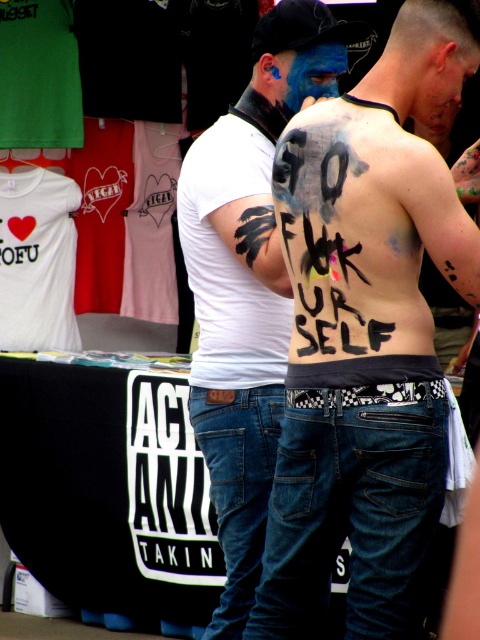
In the scene shown: Can you confirm if white matte shirt at center is wider than black paint text at back?

Yes, white matte shirt at center is wider than black paint text at back.

Is white matte shirt at center closer to the viewer compared to black paint text at back?

No, white matte shirt at center is further to the viewer.

Measure the distance between white matte shirt at center and camera.

white matte shirt at center is 4.66 meters from camera.

The height and width of the screenshot is (640, 480). Identify the location of white matte shirt at center. (247, 285).

What do you see at coordinates (367, 333) in the screenshot? I see `black matte skin at center` at bounding box center [367, 333].

Between point (399, 97) and point (262, 492), which one is positioned behind?

The point (262, 492) is more distant.

Locate an element on the screen. The height and width of the screenshot is (640, 480). black matte skin at center is located at coordinates (367, 333).

Does black paint text at back have a lesser height compared to white matte t-shirt at left?

Yes, black paint text at back is shorter than white matte t-shirt at left.

Does black paint text at back appear under white matte t-shirt at left?

Indeed, black paint text at back is positioned under white matte t-shirt at left.

Between point (362, 220) and point (27, 340), which one is positioned behind?

The point (27, 340) is more distant.

You are a GUI agent. You are given a task and a screenshot of the screen. Output one action in this format:
    pyautogui.click(x=<x>, y=<y>)
    Task: Click on the black paint text at back
    
    Given the screenshot: What is the action you would take?
    pyautogui.click(x=334, y=244)